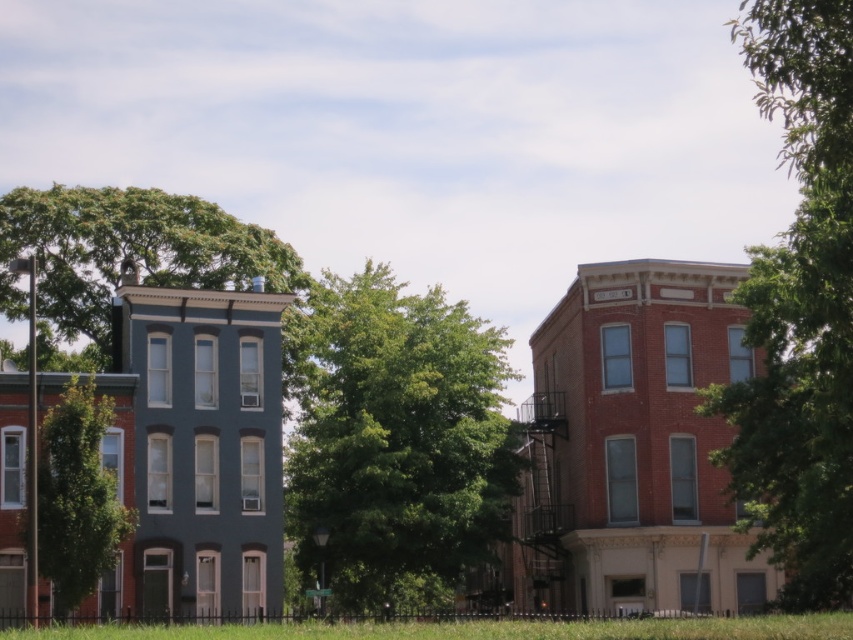
Does green leafy tree at upper right have a smaller size compared to green leafy tree at upper left?

Actually, green leafy tree at upper right might be larger than green leafy tree at upper left.

Does point (814, 484) lie behind point (212, 227)?

No.

Is point (786, 545) in front of point (74, 230)?

Yes, it is in front of point (74, 230).

Where is `green leafy tree at upper right`? This screenshot has width=853, height=640. green leafy tree at upper right is located at coordinates (799, 310).

Can you confirm if green leafy tree at center is positioned to the left of green grass at lower center?

Yes, green leafy tree at center is to the left of green grass at lower center.

Who is positioned more to the left, green leafy tree at center or green grass at lower center?

green leafy tree at center is more to the left.

What do you see at coordinates (396, 440) in the screenshot? I see `green leafy tree at center` at bounding box center [396, 440].

Where is `green leafy tree at center`? The image size is (853, 640). green leafy tree at center is located at coordinates (396, 440).

Does point (421, 474) come behind point (38, 234)?

No.

Which is behind, point (488, 410) or point (99, 220)?

Positioned behind is point (99, 220).

What do you see at coordinates (396, 440) in the screenshot?
I see `green leafy tree at center` at bounding box center [396, 440].

The height and width of the screenshot is (640, 853). In order to click on green leafy tree at center in this screenshot , I will do `click(396, 440)`.